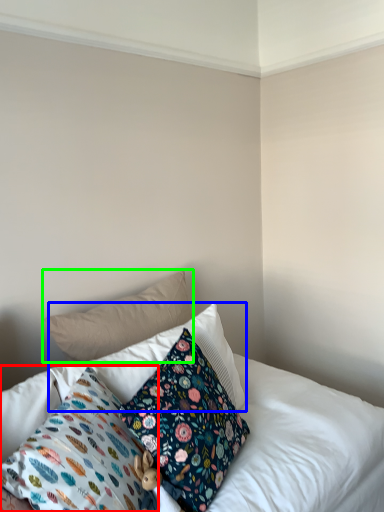
Question: Based on their relative distances, which object is nearer to pillow (highlighted by a red box)? Choose from pillow (highlighted by a blue box) and pillow (highlighted by a green box).

Choices:
 (A) pillow
 (B) pillow

Answer: (A)